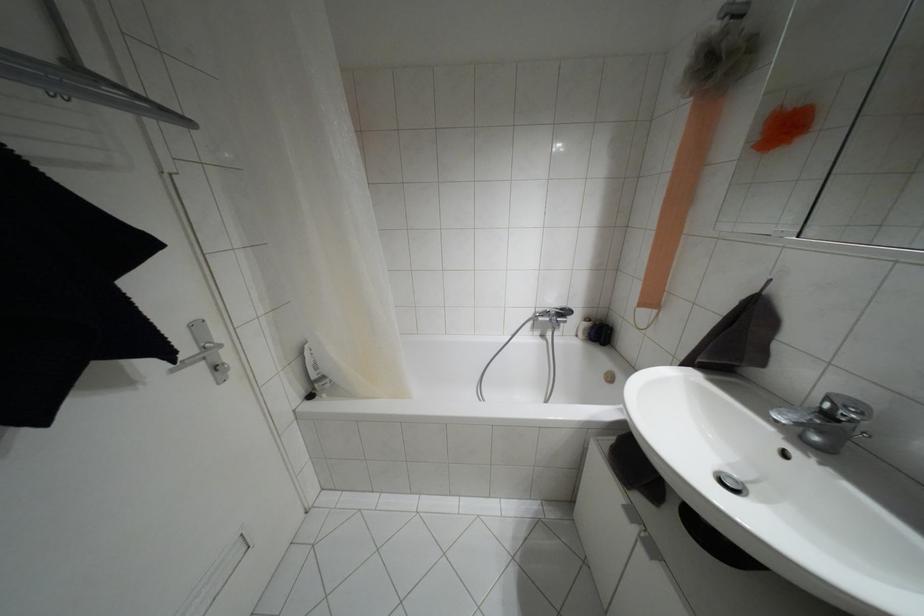
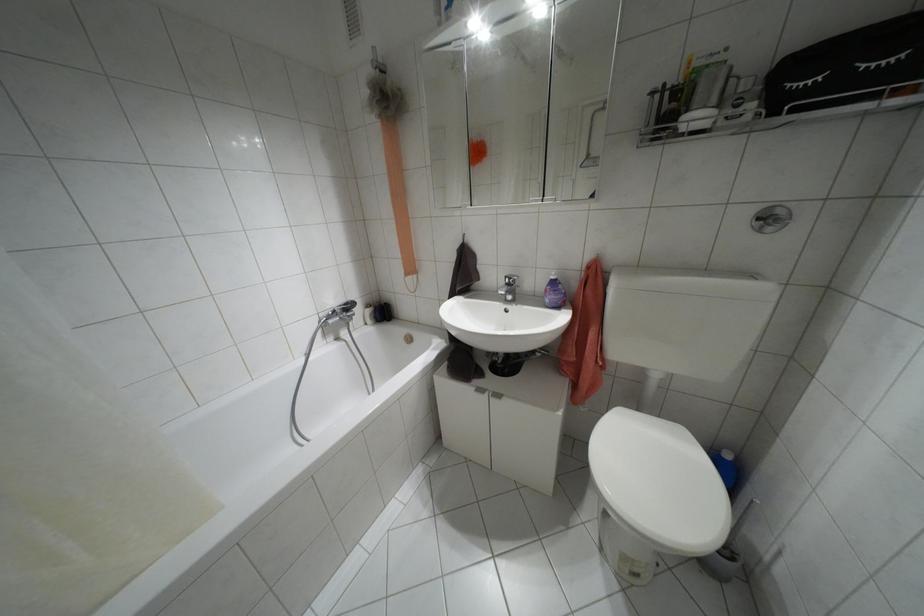
Locate, in the second image, the point that corresponds to the point at 825,414 in the first image.

(507, 284)